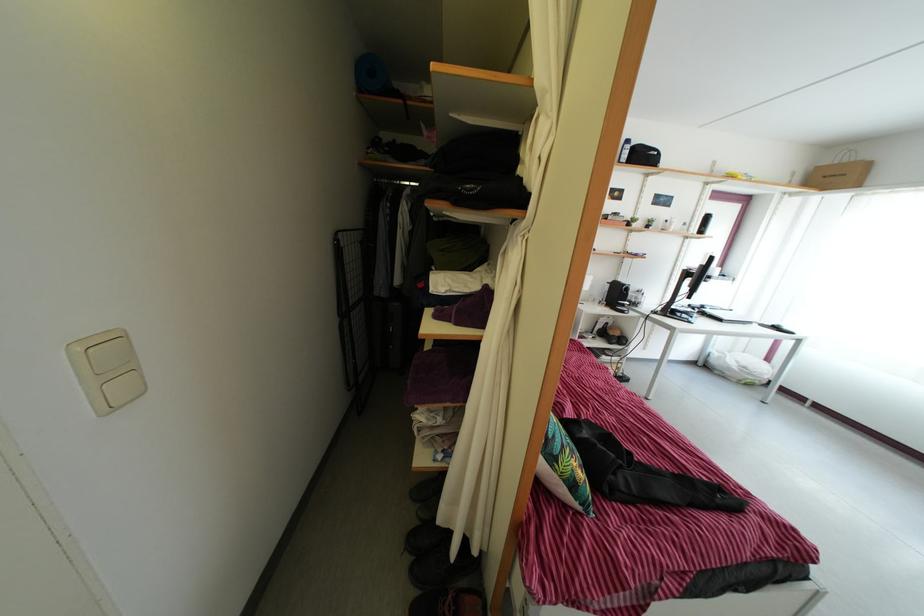
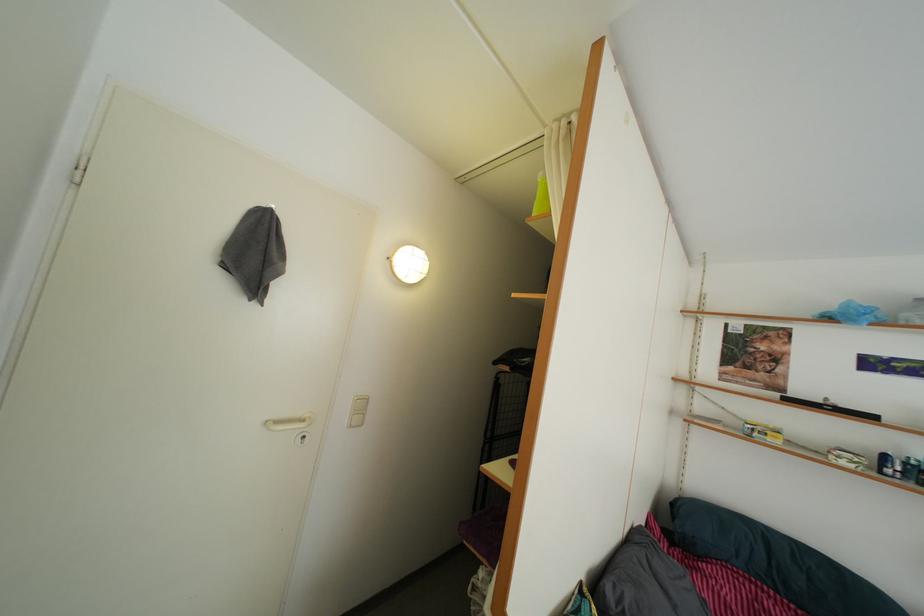
Based on the continuous images, in which direction is the camera rotating?

The camera's rotation is toward left-up.